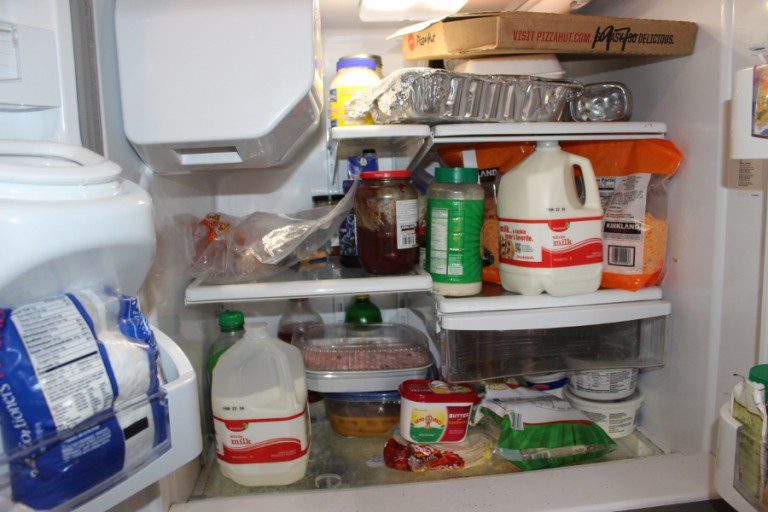
Image resolution: width=768 pixels, height=512 pixels. In order to click on fridge door in this screenshot , I will do `click(35, 117)`.